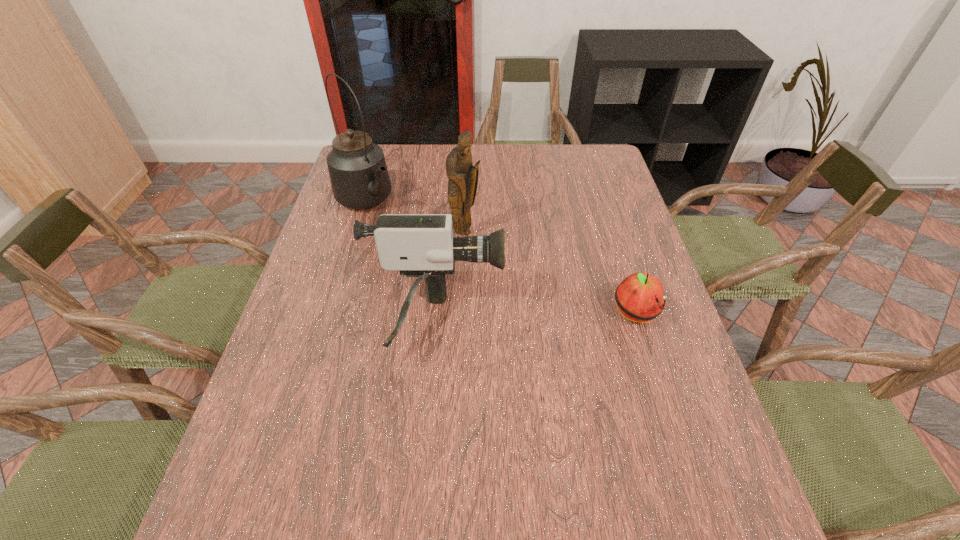
You are a GUI agent. You are given a task and a screenshot of the screen. Output one action in this format:
    pyautogui.click(x=<x>, y=<y>)
    Task: Click on the second shortest object
    This screenshot has height=540, width=960.
    Given the screenshot: What is the action you would take?
    pyautogui.click(x=418, y=245)

At what (x,y) coordinates should I click in order to perform the action: click on the shortest object. Please return your answer as a coordinate pair (x, y). Looking at the image, I should click on (640, 297).

Where is `the rightmost object`? This screenshot has height=540, width=960. the rightmost object is located at coordinates (640, 297).

The width and height of the screenshot is (960, 540). In order to click on the farthest object in this screenshot , I will do `click(358, 172)`.

Locate an element on the screen. kettle is located at coordinates (358, 172).

I want to click on the second tallest object, so click(x=463, y=177).

The width and height of the screenshot is (960, 540). I want to click on figurine, so click(x=463, y=177).

Locate an element on the screen. This screenshot has width=960, height=540. free location located on the recording direction of the third tallest object is located at coordinates (607, 322).

Find the location of a particular element. This screenshot has width=960, height=540. vacant region located spout on the tallest object is located at coordinates (425, 248).

Locate an element on the screen. Image resolution: width=960 pixels, height=540 pixels. free region located 0.230m spout on the tallest object is located at coordinates (432, 253).